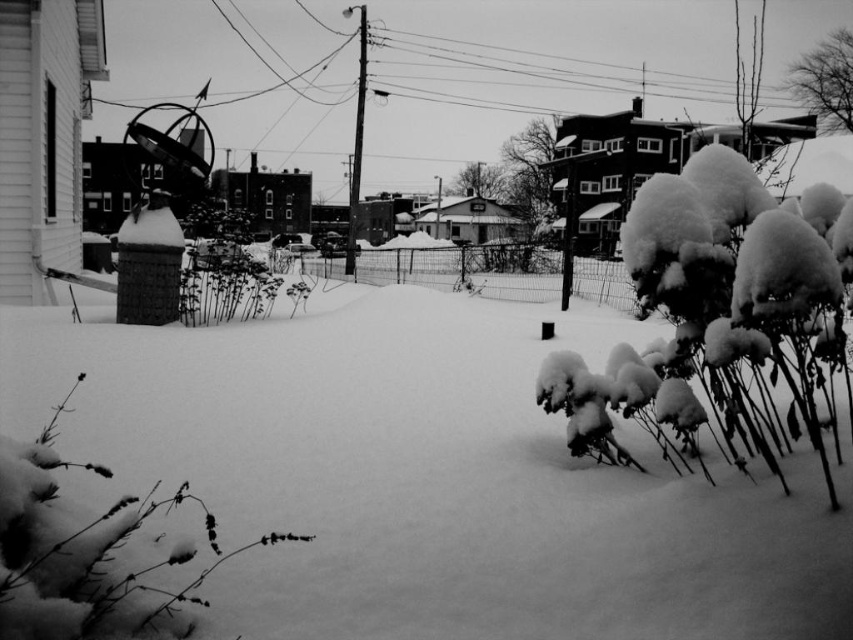
Question: Which of the following is the farthest from the observer?

Choices:
 (A) (788, 212)
 (B) (22, 611)

Answer: (A)

Question: Which of the following is the farthest from the observer?

Choices:
 (A) (711, 200)
 (B) (173, 616)

Answer: (A)

Question: Is fuzzy snow-covered bush at right to the right of fuzzy snow-covered plant at lower left from the viewer's perspective?

Choices:
 (A) yes
 (B) no

Answer: (A)

Question: Where is fuzzy snow-covered bush at right located in relation to fuzzy snow-covered plant at lower left in the image?

Choices:
 (A) right
 (B) left

Answer: (A)

Question: Can you confirm if fuzzy snow-covered bush at right is thinner than fuzzy snow-covered plant at lower left?

Choices:
 (A) no
 (B) yes

Answer: (A)